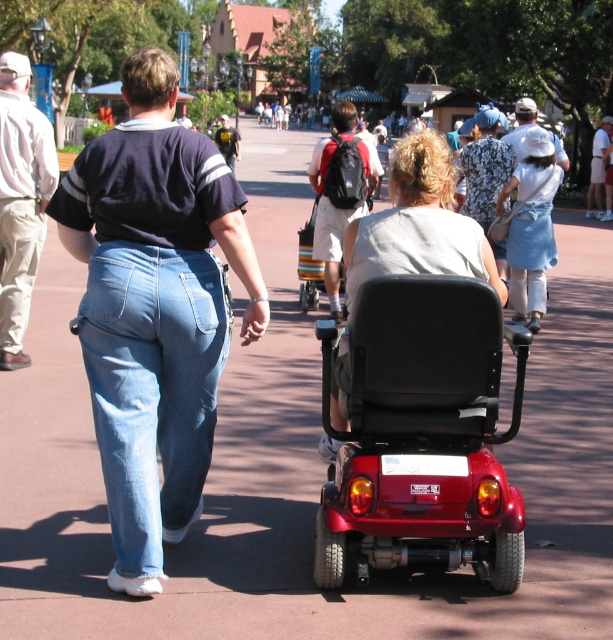
You are a photographer trying to capture a candid shot of the two people in the scene. The floral fabric dress at center and the dark blue shirt at upper center are both in your viewfinder. Based on their positions, which one is closer to the camera?

The floral fabric dress at center is closer to the camera because it has a lesser height compared to the dark blue shirt at upper center, indicating it is nearer.

You are standing at point (31,154) and want to walk to point (99,355). Which direction should you move to get closer to your destination?

To move from point (31,154) to point (99,355), you should move towards the direction where the x and y coordinates increase, as point (99,355) is located to the right and above point (31,154) in the image plane.

In the scene shown: You are a photographer positioned at the center of the scene. You want to capture a photo that includes both the floral fabric dress at center and the dark blue shirt at upper center. Given their distance apart, will they both fit within a standard camera frame that has a maximum width of 50 feet?

The floral fabric dress at center is 49.21 feet from the dark blue shirt at upper center. Since the distance between them is less than the camera frame width of 50 feet, both will fit within the standard camera frame.